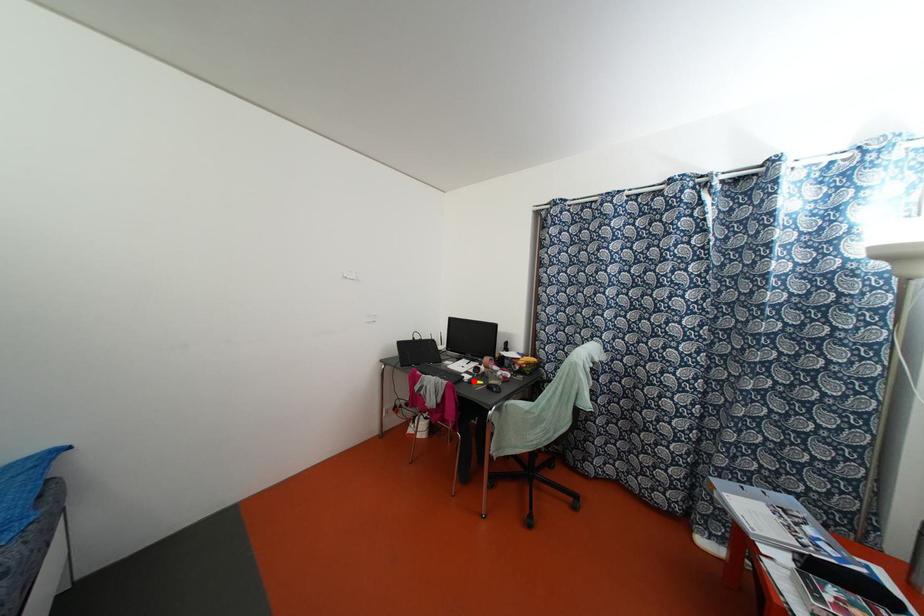
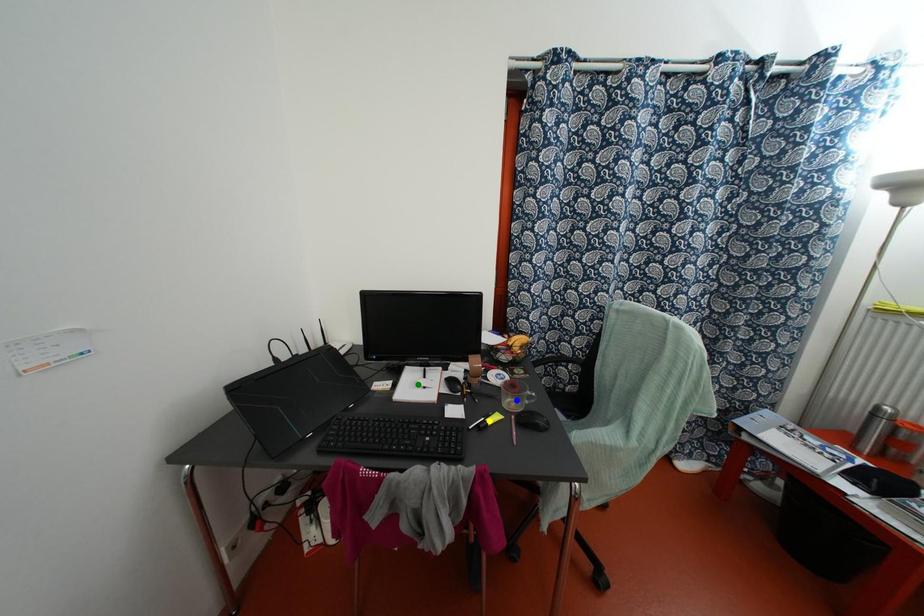
Question: I am providing you with two images of the same scene from different viewpoints. A red point is marked on the first image. You are given multiple points on the second image. Which point in image 2 represents the same 3d spot as the red point in image 1?

Choices:
 (A) blue point
 (B) green point
 (C) yellow point

Answer: (C)